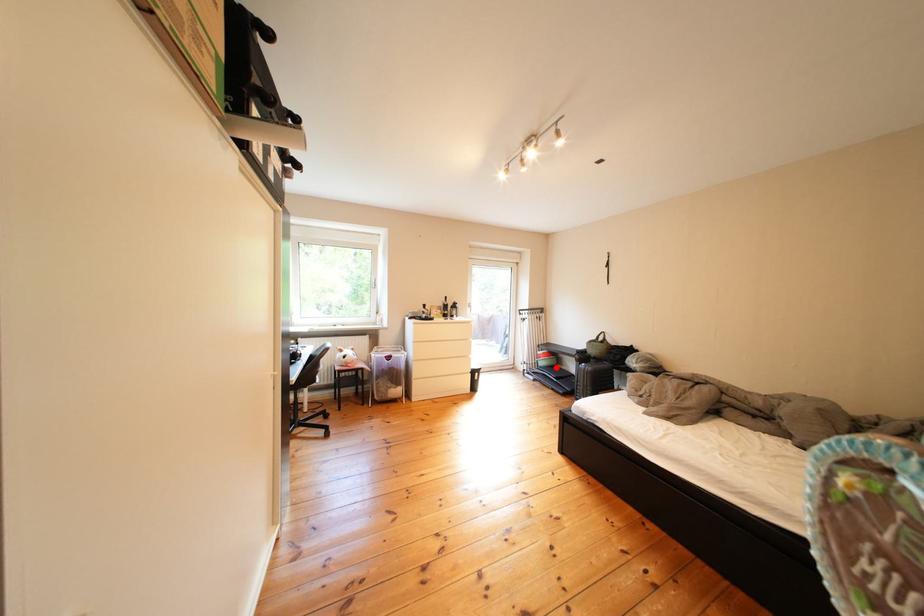
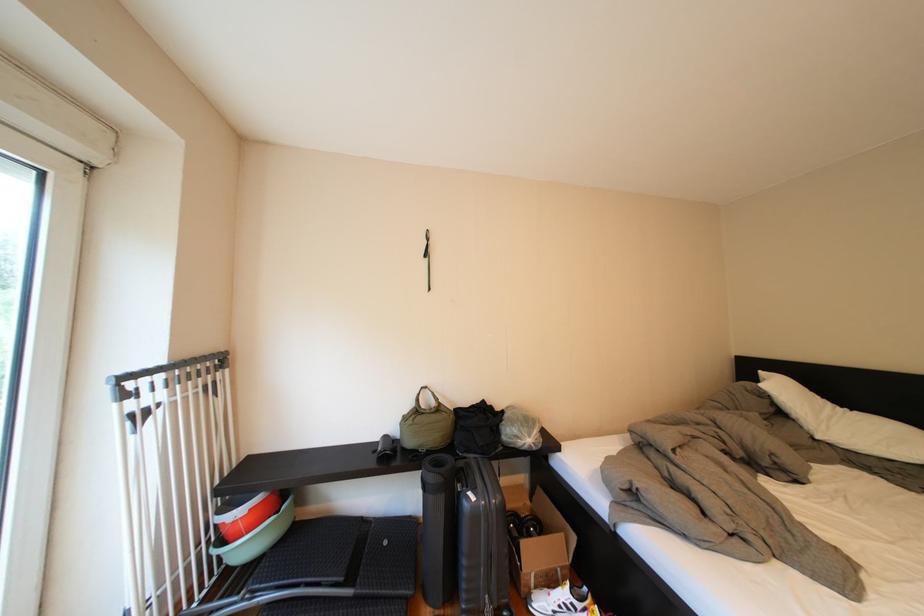
Question: I am providing you with two images of the same scene from different viewpoints. A red point is shown in image1. For the corresponding object point in image2, is it positioned nearer or farther from the camera?

Choices:
 (A) Nearer
 (B) Farther

Answer: (A)